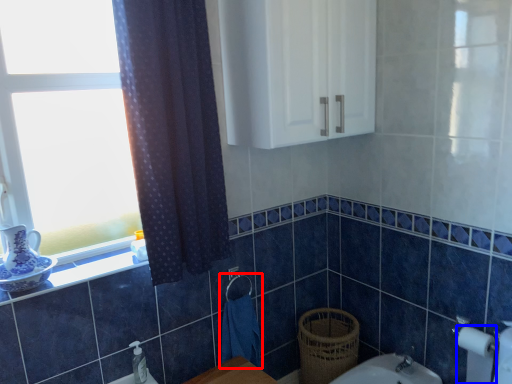
Question: Which point is closer to the camera, hand towel (highlighted by a red box) or toilet paper (highlighted by a blue box)?

Choices:
 (A) hand towel
 (B) toilet paper

Answer: (B)